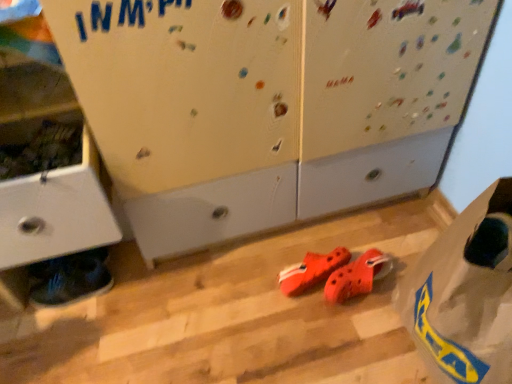
Question: Is rubber/crocodile-patterned shoes at center, the 2th footwear positioned from the left, behind shiny blue sneakers at lower left, positioned as the 1th footwear in left-to-right order?

Choices:
 (A) yes
 (B) no

Answer: (B)

Question: Does rubber/crocodile-patterned shoes at center, placed as the 2th footwear when sorted from right to left, have a lesser width compared to shiny blue sneakers at lower left, which appears as the third footwear when viewed from the right?

Choices:
 (A) no
 (B) yes

Answer: (A)

Question: Does rubber/crocodile-patterned shoes at center, the 2th footwear positioned from the left, touch shiny blue sneakers at lower left, positioned as the 1th footwear in left-to-right order?

Choices:
 (A) no
 (B) yes

Answer: (A)

Question: Considering the relative sizes of rubber/crocodile-patterned shoes at center, the 2th footwear positioned from the left, and shiny blue sneakers at lower left, which appears as the third footwear when viewed from the right, in the image provided, is rubber/crocodile-patterned shoes at center, the 2th footwear positioned from the left, smaller than shiny blue sneakers at lower left, which appears as the third footwear when viewed from the right,?

Choices:
 (A) no
 (B) yes

Answer: (B)

Question: Are rubber/crocodile-patterned shoes at center, the 2th footwear positioned from the left, and shiny blue sneakers at lower left, positioned as the 1th footwear in left-to-right order, far apart?

Choices:
 (A) no
 (B) yes

Answer: (A)

Question: From a real-world perspective, is rubber/crocodile-patterned shoes at center, placed as the 2th footwear when sorted from right to left, below shiny blue sneakers at lower left, positioned as the 1th footwear in left-to-right order?

Choices:
 (A) yes
 (B) no

Answer: (A)

Question: Does shiny blue sneakers at lower left, positioned as the 1th footwear in left-to-right order, have a greater width compared to transparent plastic bag at lower right?

Choices:
 (A) yes
 (B) no

Answer: (B)

Question: From the image's perspective, is shiny blue sneakers at lower left, positioned as the 1th footwear in left-to-right order, on transparent plastic bag at lower right?

Choices:
 (A) no
 (B) yes

Answer: (A)

Question: From a real-world perspective, is shiny blue sneakers at lower left, which appears as the third footwear when viewed from the right, located higher than transparent plastic bag at lower right?

Choices:
 (A) yes
 (B) no

Answer: (B)

Question: Is shiny blue sneakers at lower left, positioned as the 1th footwear in left-to-right order, far away from transparent plastic bag at lower right?

Choices:
 (A) yes
 (B) no

Answer: (B)

Question: Is transparent plastic bag at lower right surrounded by shiny blue sneakers at lower left, positioned as the 1th footwear in left-to-right order?

Choices:
 (A) no
 (B) yes

Answer: (A)

Question: Does shiny blue sneakers at lower left, positioned as the 1th footwear in left-to-right order, have a lesser height compared to transparent plastic bag at lower right?

Choices:
 (A) yes
 (B) no

Answer: (A)

Question: Does matte white cabinet at left touch transparent plastic bag at lower right?

Choices:
 (A) no
 (B) yes

Answer: (A)